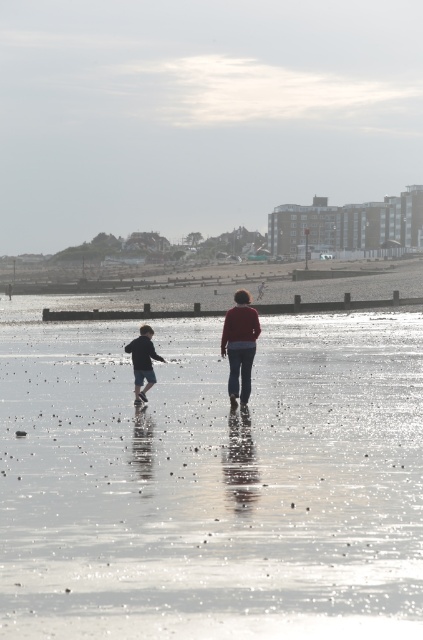
In the scene shown: You are a photographer planning to capture the reflection of the matte red sweater at center on the smooth sand beach at center. Given the size difference between them, which object will occupy more of the frame in your photo?

The smooth sand beach at center has a larger size compared to the matte red sweater at center, so it will occupy more of the frame in the photo.

You are standing at the point marked as point (213,483) in the image. What type of terrain do you find yourself on?

At point (213,483) lies smooth sand beach at center.

You are standing on the beach and want to walk from the dark blue denim shorts at left to the smooth sand beach at center. Which direction should you move?

You should move to the right to reach the smooth sand beach at center from the dark blue denim shorts at left since the smooth sand beach at center is located to the right of the dark blue denim shorts at left.